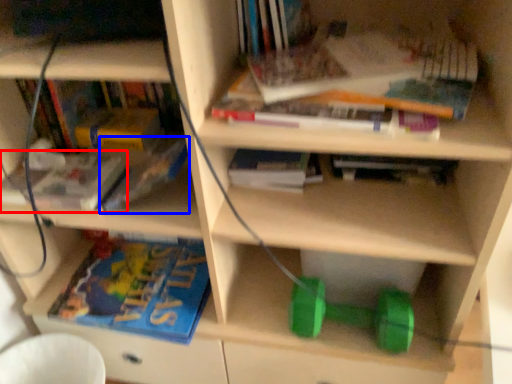
Question: Which of the following is the closest to the observer, book (highlighted by a red box) or book (highlighted by a blue box)?

Choices:
 (A) book
 (B) book

Answer: (B)